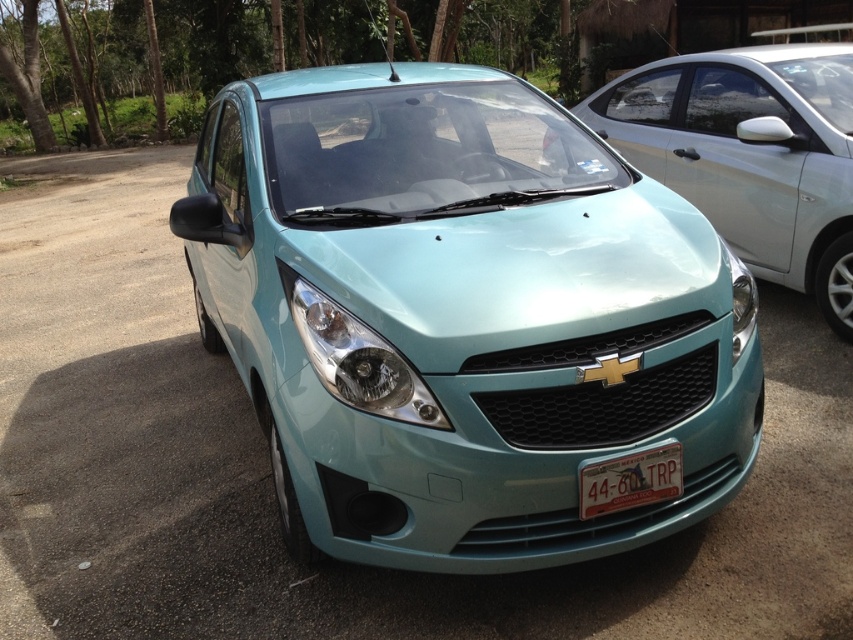
Question: Can you confirm if light blue glossy car at center is bigger than satin teal headlight at center-right?

Choices:
 (A) yes
 (B) no

Answer: (A)

Question: Which object is positioned farthest from the satin teal headlight at center-right?

Choices:
 (A) satin teal headlight at center
 (B) teal glossy car at center
 (C) light blue glossy car at center

Answer: (C)

Question: Among these points, which one is farthest from the camera?

Choices:
 (A) (589, 490)
 (B) (741, 273)
 (C) (451, 148)

Answer: (C)

Question: Which object appears closest to the camera in this image?

Choices:
 (A) white plastic license plate at center
 (B) teal glossy car at center
 (C) light blue glossy car at center

Answer: (B)

Question: Does white plastic license plate at center appear over satin teal headlight at center-right?

Choices:
 (A) no
 (B) yes

Answer: (A)

Question: Can you confirm if satin teal headlight at center is positioned above satin teal headlight at center-right?

Choices:
 (A) yes
 (B) no

Answer: (B)